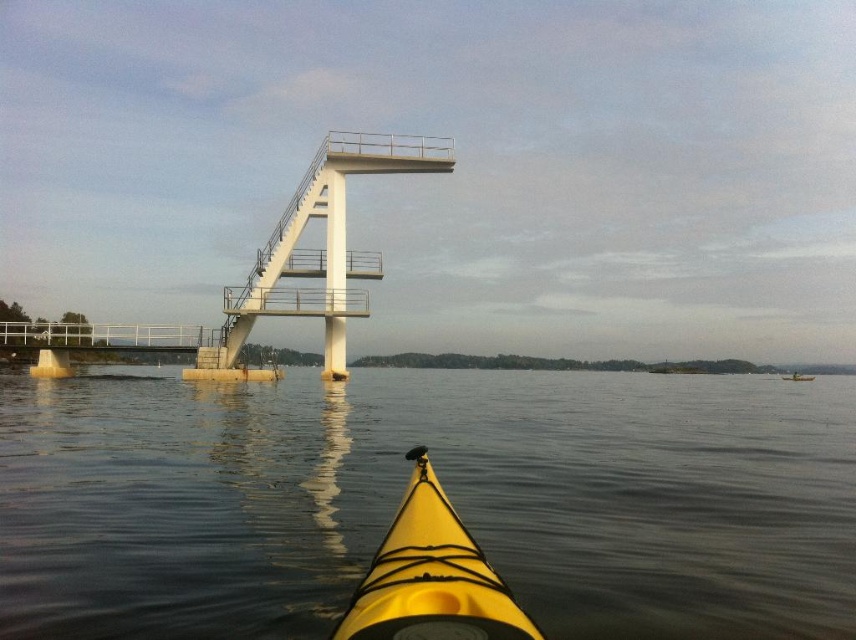
Question: Is yellow rubber kayak at center wider than yellow matte kayak at lower center?

Choices:
 (A) no
 (B) yes

Answer: (B)

Question: Among these points, which one is farthest from the camera?

Choices:
 (A) (519, 451)
 (B) (411, 561)
 (C) (266, 378)

Answer: (C)

Question: Considering the real-world distances, which object is farthest from the yellow matte kayak at lower center?

Choices:
 (A) white metallic bridge at center
 (B) yellow rubber kayak at center

Answer: (A)

Question: Which is farther from the yellow rubber kayak at center?

Choices:
 (A) yellow matte kayak at lower center
 (B) white metallic bridge at center

Answer: (A)

Question: Can you confirm if yellow rubber kayak at center is positioned below white metallic bridge at center?

Choices:
 (A) no
 (B) yes

Answer: (B)

Question: Does yellow rubber kayak at center appear under yellow matte kayak at lower center?

Choices:
 (A) no
 (B) yes

Answer: (B)